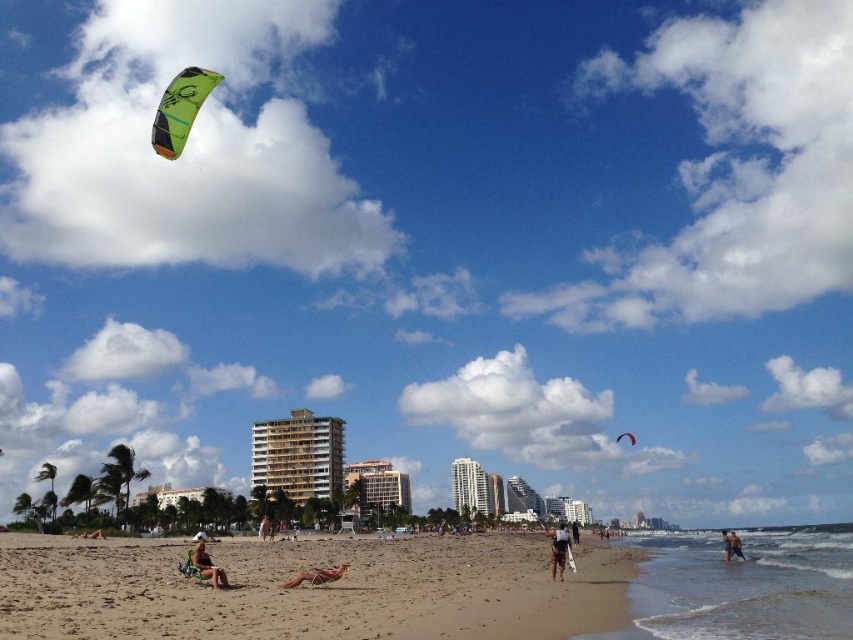
You are a photographer trying to capture both the green matte parachute at upper left and the tan bikini at center in a single shot. Which object should you focus on first to ensure both are in frame?

You should focus on the tan bikini at center first because the green matte parachute at upper left is shorter in height, so adjusting the camera angle to include the taller tan bikini at center will naturally include the shorter green matte parachute at upper left in the frame.

You are a photographer standing at the edge of the beach. You want to take a photo that includes both the tan bikini at center and the white fabric surfboard at lower right. What is the minimum distance you need to move backward to ensure both objects are in frame?

The minimum distance you need to move backward is 72.33 meters to ensure both the tan bikini at center and the white fabric surfboard at lower right are in frame.

You are standing at the beach and want to know how far the point at coordinates [190,120] is from you. Can you determine the distance?

The distance of point [190,120] from camera is 58.04 meters.